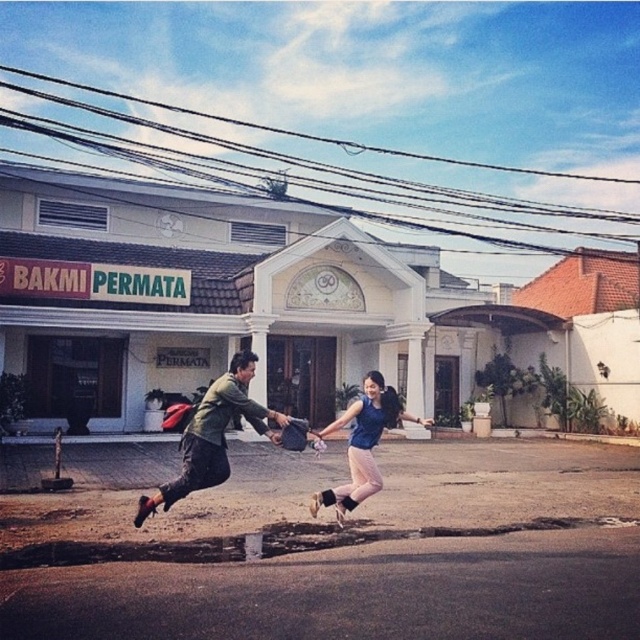
Which of these two, brown asphalt puddle at lower center or blue fabric dress at center, stands taller?

Standing taller between the two is blue fabric dress at center.

Is brown asphalt puddle at lower center further to camera compared to blue fabric dress at center?

No, it is in front of blue fabric dress at center.

Identify the location of brown asphalt puddle at lower center. Image resolution: width=640 pixels, height=640 pixels. (262, 541).

Can you confirm if brown asphalt puddle at lower center is taller than green matte jacket at center?

Correct, brown asphalt puddle at lower center is much taller as green matte jacket at center.

I want to click on brown asphalt puddle at lower center, so click(262, 541).

Does point (16, 554) come farther from viewer compared to point (234, 378)?

That is True.

Identify the location of brown asphalt puddle at lower center. This screenshot has height=640, width=640. (262, 541).

Can you confirm if green matte jacket at center is thinner than blue fabric dress at center?

Correct, green matte jacket at center's width is less than blue fabric dress at center's.

Between point (177, 499) and point (332, 490), which one is positioned behind?

Point (332, 490)

In order to click on green matte jacket at center in this screenshot , I will do `click(212, 435)`.